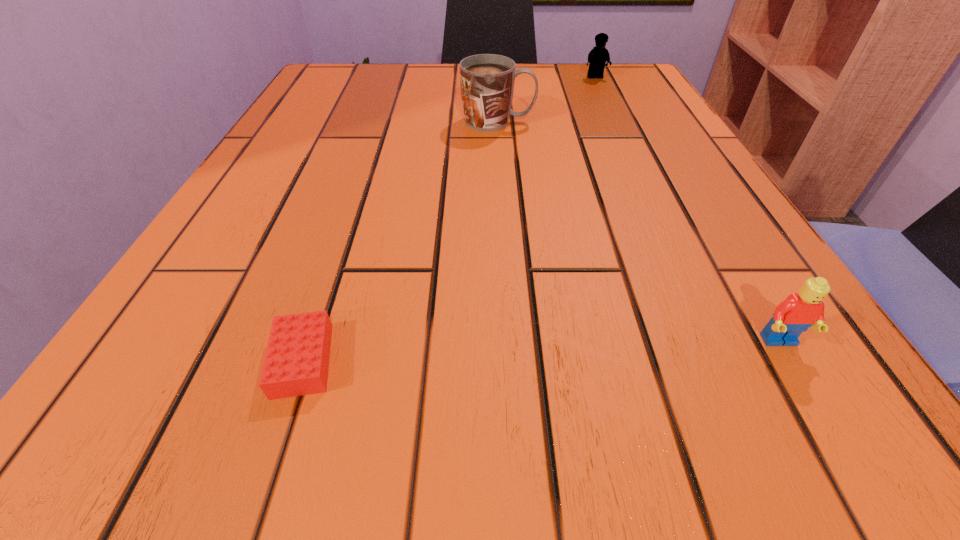
You are a GUI agent. You are given a task and a screenshot of the screen. Output one action in this format:
    pyautogui.click(x=<x>, y=<y>)
    Task: Click on the empty space between the second Lego from right to left and the mug
    
    Given the screenshot: What is the action you would take?
    pyautogui.click(x=546, y=99)

The height and width of the screenshot is (540, 960). I want to click on vacant space in between the leftmost object and the mug, so click(x=400, y=241).

Where is `object that is the second closest one to the mug`? Image resolution: width=960 pixels, height=540 pixels. object that is the second closest one to the mug is located at coordinates (296, 363).

At what (x,y) coordinates should I click in order to perform the action: click on object that can be found as the third closest to the rightmost Lego. Please return your answer as a coordinate pair (x, y). The image size is (960, 540). Looking at the image, I should click on (598, 56).

Identify which Lego is located as the nearest to the rightmost object. Please provide its 2D coordinates. Your answer should be formatted as a tuple, i.e. [(x, y)], where the tuple contains the x and y coordinates of a point satisfying the conditions above.

[(296, 363)]

Identify which Lego is located as the nearest to the mug. Please provide its 2D coordinates. Your answer should be formatted as a tuple, i.e. [(x, y)], where the tuple contains the x and y coordinates of a point satisfying the conditions above.

[(598, 56)]

At what (x,y) coordinates should I click in order to perform the action: click on free point that satisfies the following two spatial constraints: 1. on the front-facing side of the farthest object; 2. on the side of the mug with the handle. Please return your answer as a coordinate pair (x, y). The width and height of the screenshot is (960, 540). Looking at the image, I should click on (616, 122).

The width and height of the screenshot is (960, 540). In order to click on free region that satisfies the following two spatial constraints: 1. on the front-facing side of the second Lego from left to right; 2. on the side of the third object from right to left with the handle in this screenshot , I will do `click(616, 122)`.